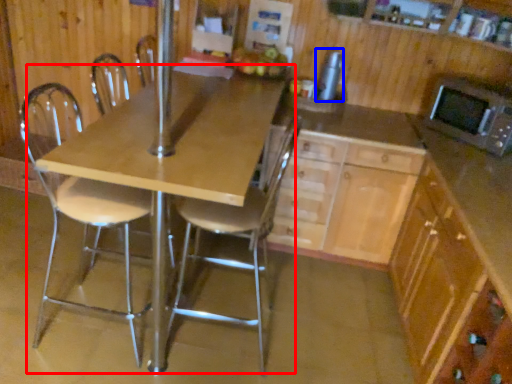
Question: Which of the following is the closest to the observer, table (highlighted by a red box) or appliance (highlighted by a blue box)?

Choices:
 (A) table
 (B) appliance

Answer: (A)